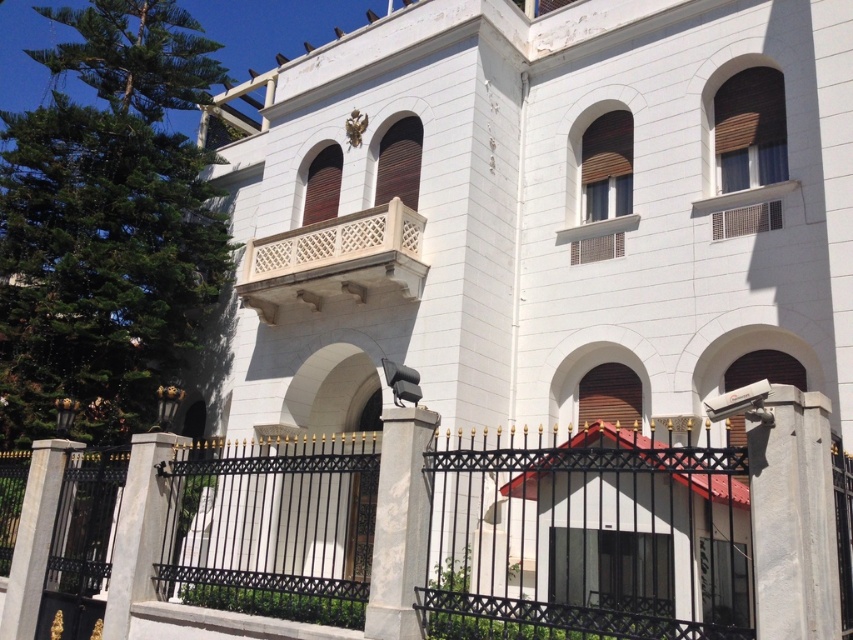
Question: Based on their relative distances, which object is farther from the gray concrete security camera at right?

Choices:
 (A) black wrought iron fence at center
 (B) gray stone column at center
 (C) white stone pillar at lower left
 (D) white stone balcony at center

Answer: (C)

Question: Estimate the real-world distances between objects in this image. Which object is farther from the white stone pillar at lower left?

Choices:
 (A) gray concrete security camera at right
 (B) gray concrete pillar at lower left
 (C) white stone balcony at center

Answer: (A)

Question: Is black wrought iron fence at center further to the viewer compared to gray concrete security camera at right?

Choices:
 (A) no
 (B) yes

Answer: (B)

Question: Estimate the real-world distances between objects in this image. Which object is farther from the white stone pillar at lower left?

Choices:
 (A) white stone balcony at center
 (B) black wrought iron fence at center
 (C) gray concrete pillar at lower left
 (D) gray concrete security camera at right

Answer: (D)

Question: Is gray concrete pillar at lower left positioned behind white stone pillar at lower left?

Choices:
 (A) no
 (B) yes

Answer: (A)

Question: Does gray concrete security camera at right have a larger size compared to white stone pillar at lower left?

Choices:
 (A) yes
 (B) no

Answer: (A)